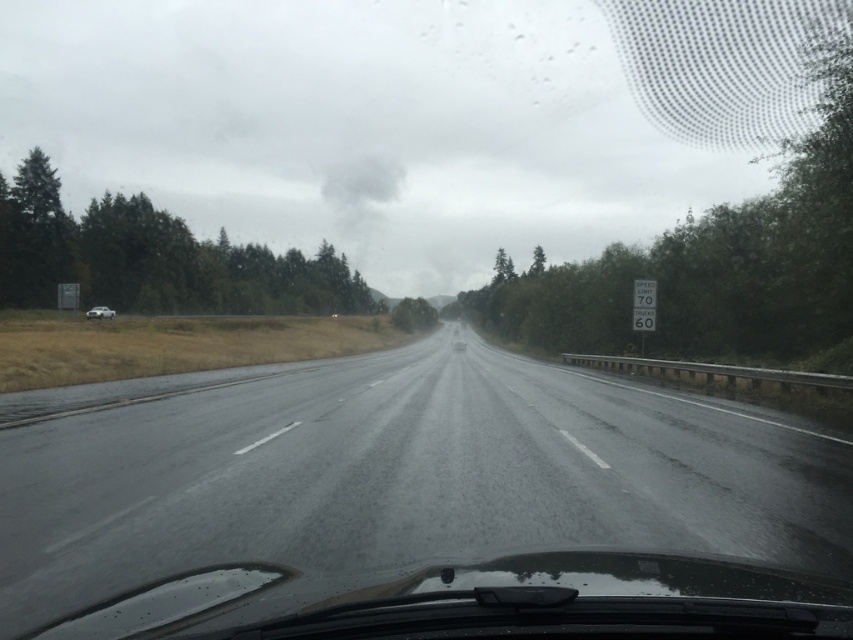
Is dark asphalt highway at center thinner than silver metallic sedan at left?

Incorrect, dark asphalt highway at center's width is not less than silver metallic sedan at left's.

Is dark asphalt highway at center shorter than silver metallic sedan at left?

Indeed, dark asphalt highway at center has a lesser height compared to silver metallic sedan at left.

Does point (381, 444) come farther from viewer compared to point (94, 317)?

No.

At what (x,y) coordinates should I click in order to perform the action: click on dark asphalt highway at center. Please return your answer as a coordinate pair (x, y). Looking at the image, I should click on (395, 472).